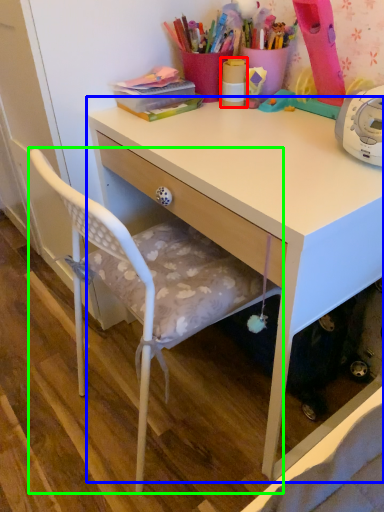
Question: Estimate the real-world distances between objects in this image. Which object is farther from office supplies (highlighted by a red box), desk (highlighted by a blue box) or chair (highlighted by a green box)?

Choices:
 (A) desk
 (B) chair

Answer: (B)